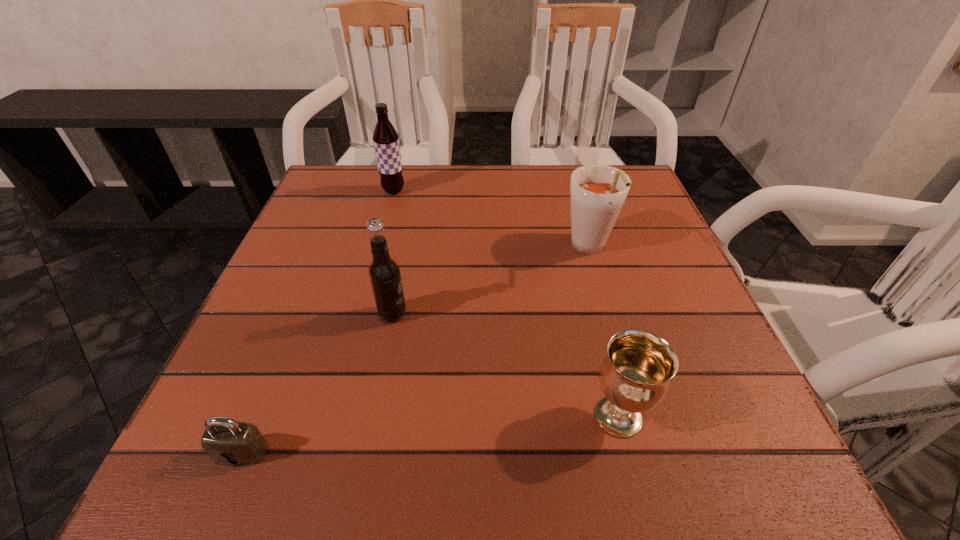
At what (x,y) coordinates should I click in order to perform the action: click on object located in the near right corner section of the desktop. Please return your answer as a coordinate pair (x, y). This screenshot has height=540, width=960. Looking at the image, I should click on 635,375.

This screenshot has height=540, width=960. I want to click on vacant area at the far edge, so click(x=568, y=196).

In the image, there is a desktop. At what (x,y) coordinates should I click in order to perform the action: click on vacant space at the near edge. Please return your answer as a coordinate pair (x, y). Looking at the image, I should click on (508, 427).

The image size is (960, 540). I want to click on free space at the left edge, so click(318, 258).

The width and height of the screenshot is (960, 540). In order to click on vacant region at the right edge of the desktop in this screenshot , I will do pos(688,296).

In the image, there is a desktop. Identify the location of vacant space at the far left corner. Image resolution: width=960 pixels, height=540 pixels. (337, 214).

The height and width of the screenshot is (540, 960). I want to click on blank space at the near left corner of the desktop, so click(x=187, y=441).

Locate an element on the screen. This screenshot has width=960, height=540. vacant space at the far right corner is located at coordinates (606, 165).

At what (x,y) coordinates should I click in order to perform the action: click on vacant space at the near right corner. Please return your answer as a coordinate pair (x, y). Looking at the image, I should click on (703, 428).

Where is `unoccupied position between the farthest object and the rightmost root beer`? unoccupied position between the farthest object and the rightmost root beer is located at coordinates (492, 220).